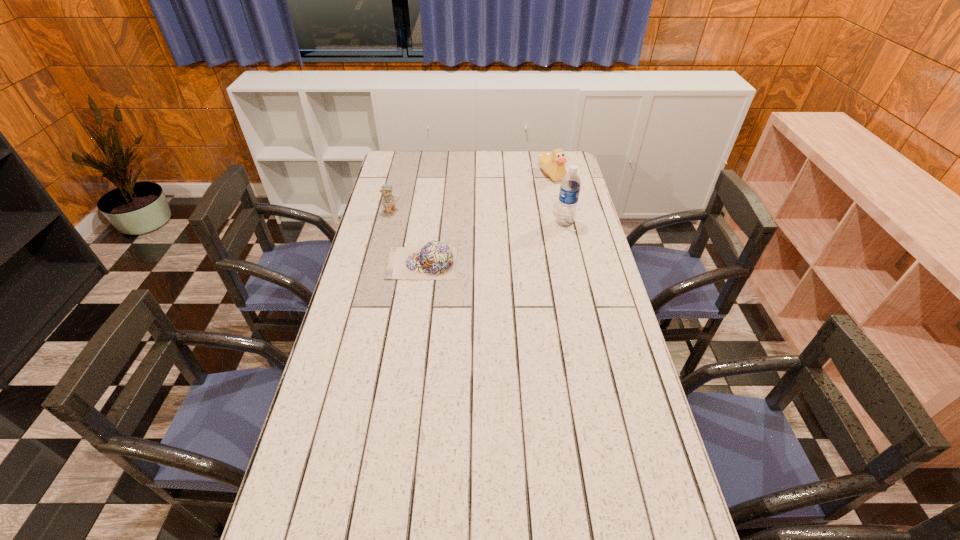
Locate an element on the screen. The width and height of the screenshot is (960, 540). object positioned at the far right corner is located at coordinates (552, 164).

This screenshot has width=960, height=540. Find the location of `free region at the far edge of the desktop`. free region at the far edge of the desktop is located at coordinates coord(535,152).

In the image, there is a desktop. Identify the location of free space at the left edge. Image resolution: width=960 pixels, height=540 pixels. (384, 178).

In the image, there is a desktop. Identify the location of vacant space at the right edge. The height and width of the screenshot is (540, 960). (574, 251).

I want to click on vacant space at the far left corner of the desktop, so click(x=391, y=165).

I want to click on vacant space at the near left corner of the desktop, so click(x=336, y=538).

Where is `vacant region at the far right corner of the desktop`? vacant region at the far right corner of the desktop is located at coordinates (552, 151).

Locate an element on the screen. free point between the duck and the cap is located at coordinates (487, 219).

Locate an element on the screen. This screenshot has width=960, height=540. free space that is in between the farthest object and the cap is located at coordinates (487, 219).

Where is `free space between the water bottle and the teddy bear`? This screenshot has width=960, height=540. free space between the water bottle and the teddy bear is located at coordinates (478, 218).